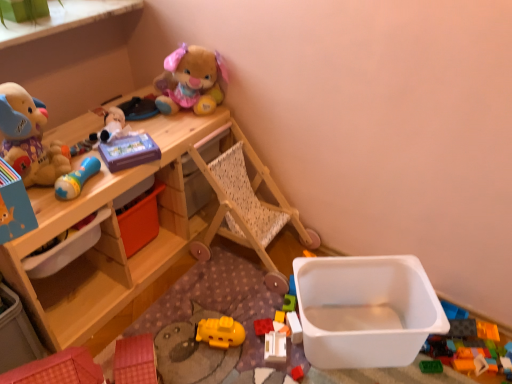
Identify the location of vacant area on the back side of yellow plastic submarine at center, the sixth toy when ordered from top to bottom. (224, 297).